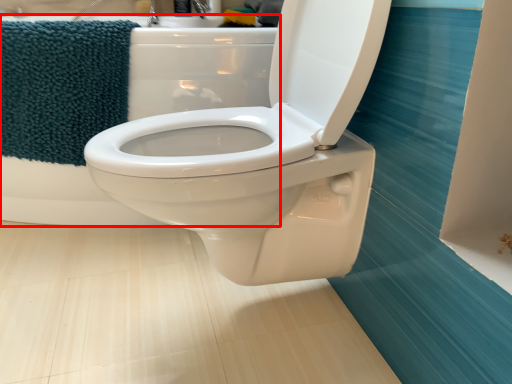
Question: From the image's perspective, what is the correct spatial positioning of bath (annotated by the red box) in reference to beach towel?

Choices:
 (A) above
 (B) below

Answer: (A)